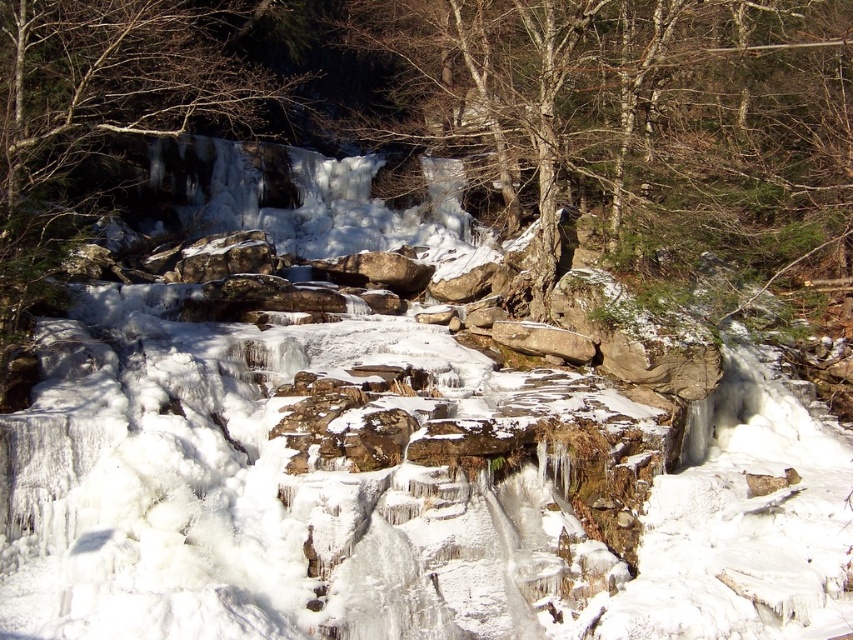
Question: Considering the relative positions of bare wood tree at center and smooth bark tree at upper left in the image provided, where is bare wood tree at center located with respect to smooth bark tree at upper left?

Choices:
 (A) left
 (B) right

Answer: (B)

Question: Is bare wood tree at center above smooth bark tree at upper left?

Choices:
 (A) no
 (B) yes

Answer: (B)

Question: Does bare wood tree at center have a lesser width compared to smooth bark tree at upper left?

Choices:
 (A) yes
 (B) no

Answer: (B)

Question: Among these points, which one is farthest from the camera?

Choices:
 (A) (67, 51)
 (B) (595, 61)

Answer: (B)